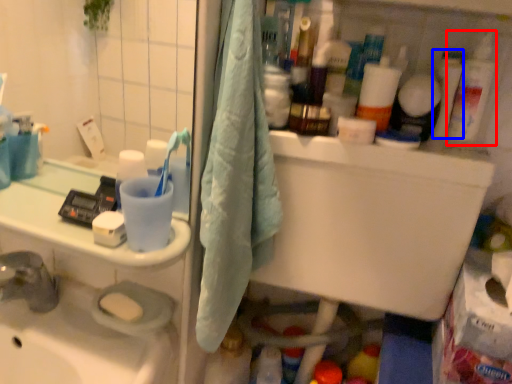
Question: Which object appears closest to the camera in this image, cleaning product (highlighted by a red box) or toiletry (highlighted by a blue box)?

Choices:
 (A) cleaning product
 (B) toiletry

Answer: (A)